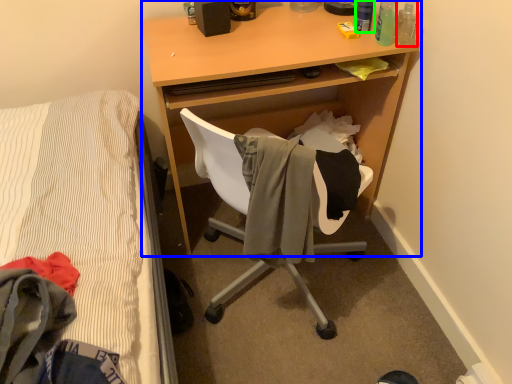
Question: Estimate the real-world distances between objects in this image. Which object is closer to bottle (highlighted by a red box), desk (highlighted by a blue box) or bottle (highlighted by a green box)?

Choices:
 (A) desk
 (B) bottle

Answer: (B)